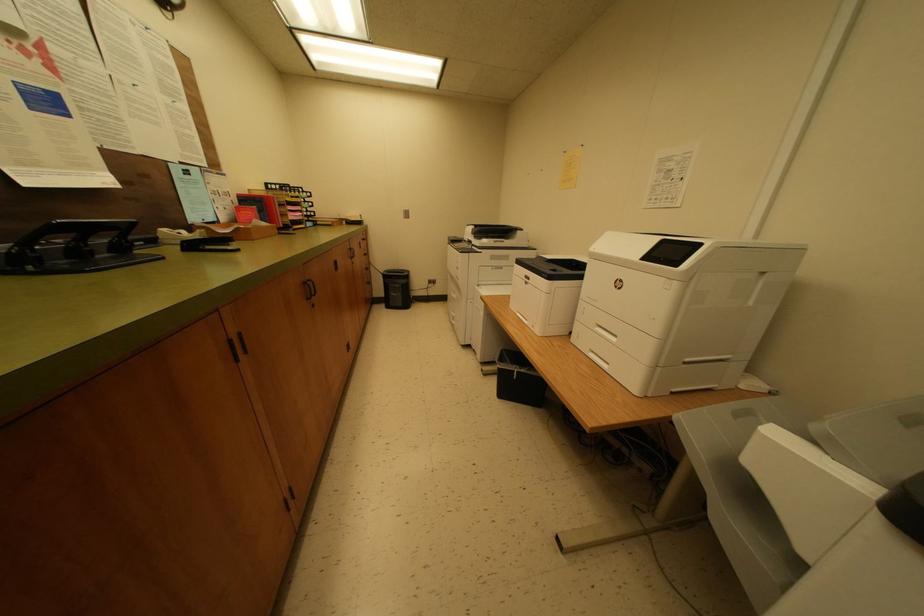
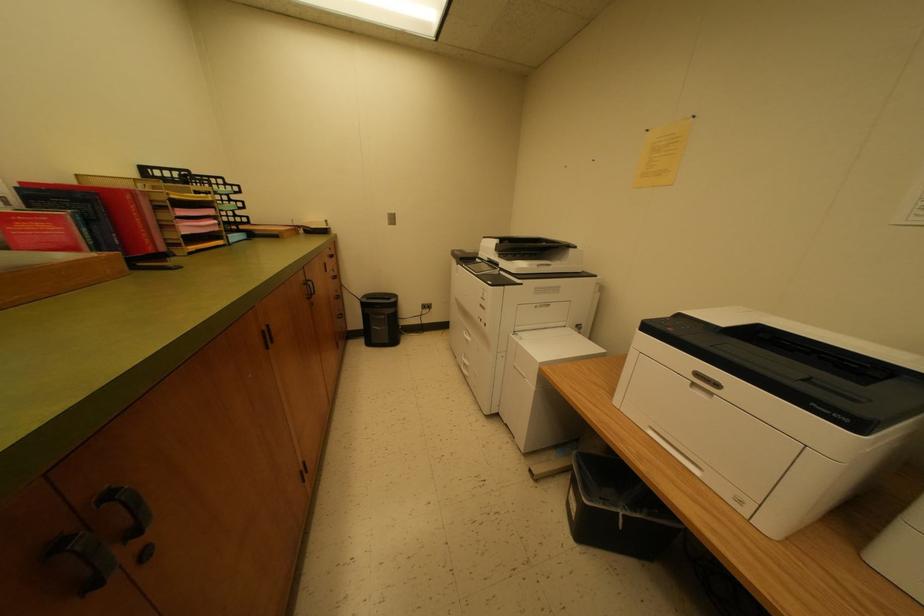
Question: The camera is either moving clockwise (left) or counter-clockwise (right) around the object. The first image is from the beginning of the video and the second image is from the end. Is the camera moving left or right when shooting the video?

Choices:
 (A) Left
 (B) Right

Answer: (A)